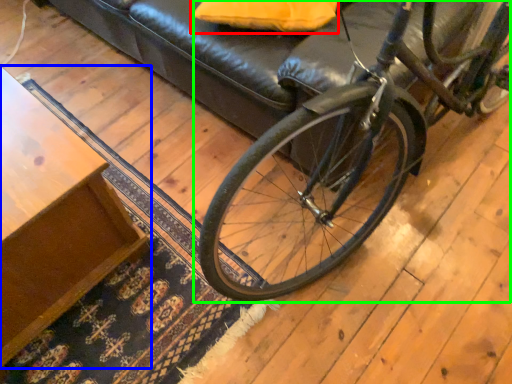
Question: Considering the real-world distances, which object is closest to pillow (highlighted by a red box)? table (highlighted by a blue box) or bicycle (highlighted by a green box).

Choices:
 (A) table
 (B) bicycle

Answer: (B)